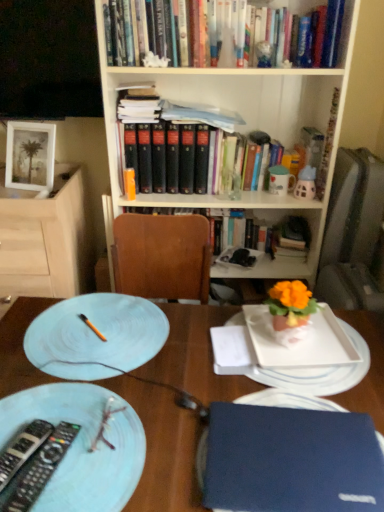
Locate an element on the screen. This screenshot has height=512, width=384. empty space that is ontop of light blue ceramic plate at center-left, the second plate from the bottom (from a real-world perspective) is located at coordinates (99, 329).